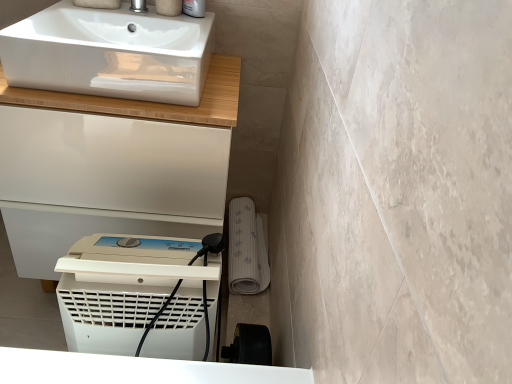
Question: Should I look upward or downward to see white glossy cabinet at upper left?

Choices:
 (A) down
 (B) up

Answer: (B)

Question: From the image's perspective, does white plastic dehumidifier at lower center appear higher than white glossy sink at upper left?

Choices:
 (A) yes
 (B) no

Answer: (B)

Question: Can you confirm if white plastic dehumidifier at lower center is positioned to the right of white glossy sink at upper left?

Choices:
 (A) yes
 (B) no

Answer: (A)

Question: Is white plastic dehumidifier at lower center not close to white glossy sink at upper left?

Choices:
 (A) no
 (B) yes

Answer: (A)

Question: Does white plastic dehumidifier at lower center touch white glossy sink at upper left?

Choices:
 (A) no
 (B) yes

Answer: (A)

Question: From a real-world perspective, is white plastic dehumidifier at lower center below white glossy sink at upper left?

Choices:
 (A) yes
 (B) no

Answer: (A)

Question: Is white plastic dehumidifier at lower center taller than white glossy sink at upper left?

Choices:
 (A) no
 (B) yes

Answer: (B)

Question: Does satin nickel faucet at upper center have a greater width compared to white glossy sink at upper left?

Choices:
 (A) yes
 (B) no

Answer: (B)

Question: Considering the relative sizes of satin nickel faucet at upper center and white glossy sink at upper left in the image provided, is satin nickel faucet at upper center bigger than white glossy sink at upper left?

Choices:
 (A) no
 (B) yes

Answer: (A)

Question: Can you confirm if satin nickel faucet at upper center is smaller than white glossy sink at upper left?

Choices:
 (A) no
 (B) yes

Answer: (B)

Question: From a real-world perspective, does satin nickel faucet at upper center sit lower than white glossy sink at upper left?

Choices:
 (A) yes
 (B) no

Answer: (B)

Question: Is satin nickel faucet at upper center placed right next to white glossy sink at upper left?

Choices:
 (A) yes
 (B) no

Answer: (B)

Question: From the image's perspective, is satin nickel faucet at upper center beneath white glossy sink at upper left?

Choices:
 (A) no
 (B) yes

Answer: (A)

Question: Does white plastic dehumidifier at lower center lie in front of satin nickel faucet at upper center?

Choices:
 (A) no
 (B) yes

Answer: (B)